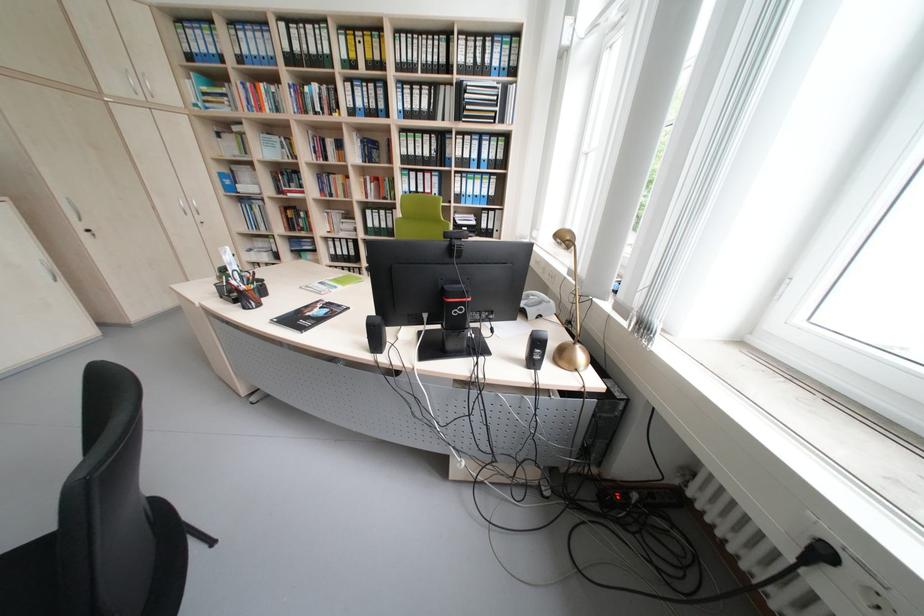
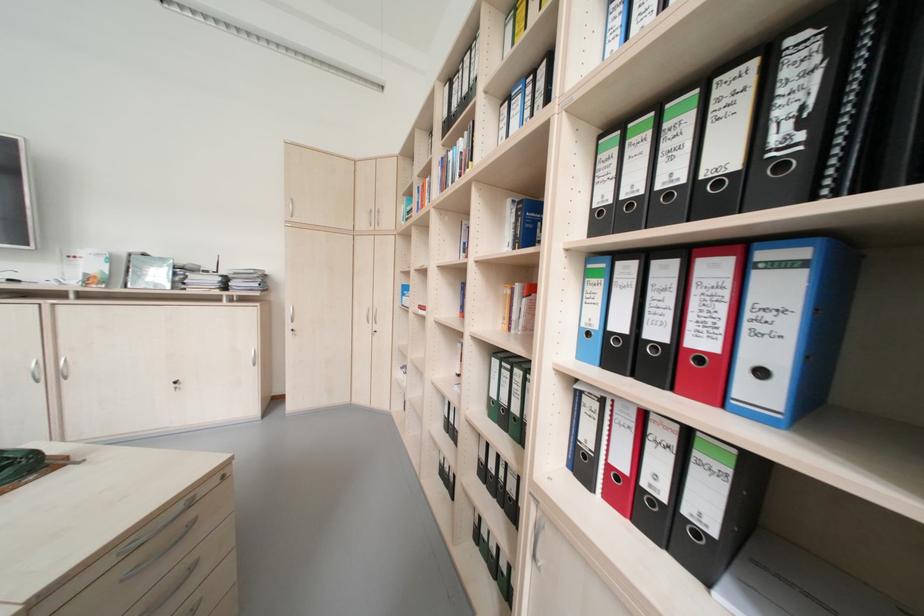
In the second image, find the point that corresponds to point (445, 180) in the first image.

(793, 290)